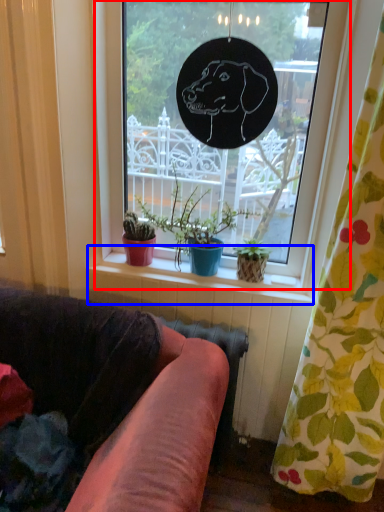
Question: Which object appears closest to the camera in this image, window (highlighted by a red box) or window sill (highlighted by a blue box)?

Choices:
 (A) window
 (B) window sill

Answer: (A)